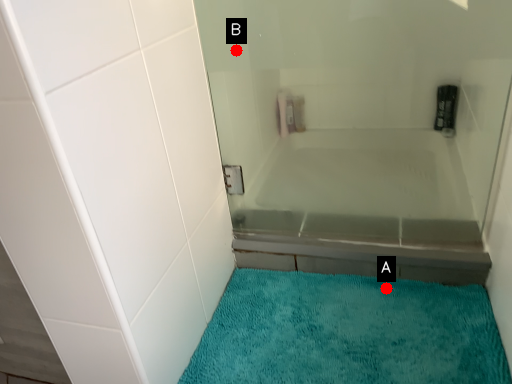
Question: Two points are circled on the image, labeled by A and B beside each circle. Which point appears farthest from the camera in this image?

Choices:
 (A) A is further
 (B) B is further

Answer: (A)